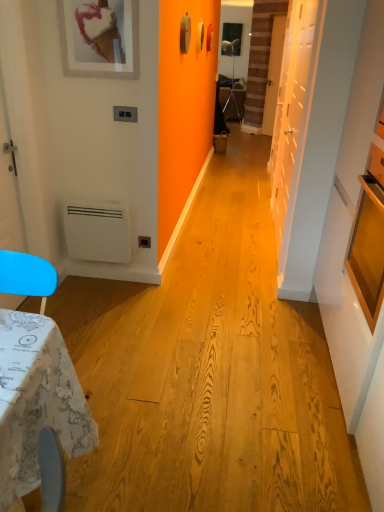
What do you see at coordinates (293, 114) in the screenshot? I see `white matte door at right, placed as the 1th door when sorted from front to back` at bounding box center [293, 114].

Describe the element at coordinates (100, 37) in the screenshot. The width and height of the screenshot is (384, 512). I see `white matte picture frame at upper left` at that location.

Describe the element at coordinates (232, 98) in the screenshot. I see `matte black tripod at center` at that location.

This screenshot has width=384, height=512. Describe the element at coordinates (97, 232) in the screenshot. I see `white matte heater at lower left` at that location.

In order to face wooden door at center, which ranks as the 1th door in back-to-front order, should I rotate leftwards or rightwards?

You should rotate right by 10.668 degrees.

You are a GUI agent. You are given a task and a screenshot of the screen. Output one action in this format:
    pyautogui.click(x=<x>, y=<y>)
    Task: Click on the white matte door at right, which is counted as the second door, starting from the back
    Image resolution: width=384 pixels, height=512 pixels.
    Given the screenshot: What is the action you would take?
    pyautogui.click(x=293, y=114)

From the image's perspective, which one is positioned lower, white matte door at right, placed as the 2th door when sorted from right to left, or white matte heater at lower left?

white matte heater at lower left, from the image's perspective.

Between white matte door at right, which is counted as the second door, starting from the back, and white matte heater at lower left, which one is positioned behind?

white matte heater at lower left is further from the camera.

Between point (299, 125) and point (92, 254), which one is positioned in front?

The point (92, 254) is in front.

Is white matte door at right, which ranks as the second door in top-to-bottom order, thinner than white matte heater at lower left?

Yes, white matte door at right, which ranks as the second door in top-to-bottom order, is thinner than white matte heater at lower left.

Considering the sizes of objects white matte heater at lower left and white matte picture frame at upper left in the image provided, who is taller, white matte heater at lower left or white matte picture frame at upper left?

white matte heater at lower left is taller.

Consider the image. From the image's perspective, is white matte heater at lower left over white matte picture frame at upper left?

Incorrect, from the image's perspective, white matte heater at lower left is lower than white matte picture frame at upper left.

Can you confirm if white matte heater at lower left is positioned to the left of white matte picture frame at upper left?

Yes.

Could you tell me if white matte heater at lower left is facing white matte picture frame at upper left?

No, white matte heater at lower left is not facing towards white matte picture frame at upper left.

From the image's perspective, relative to white matte picture frame at upper left, is wooden door at center, the 2th door positioned from the bottom, above or below?

Clearly, from the image's perspective, wooden door at center, the 2th door positioned from the bottom, is above white matte picture frame at upper left.

How much distance is there between wooden door at center, which appears as the first door when viewed from the top, and white matte picture frame at upper left?

wooden door at center, which appears as the first door when viewed from the top, is 15.36 feet away from white matte picture frame at upper left.

Based on the photo, does wooden door at center, the 2th door when ordered from front to back, have a greater width compared to white matte picture frame at upper left?

Yes.

There is a white matte picture frame at upper left. Where is `the 1st door below it (from a real-world perspective)`? the 1st door below it (from a real-world perspective) is located at coordinates (273, 74).

Is white matte heater at lower left not within white matte door at right, placed as the 2th door when sorted from right to left?

white matte heater at lower left is positioned outside white matte door at right, placed as the 2th door when sorted from right to left.

How many degrees apart are the facing directions of white matte heater at lower left and white matte door at right, placed as the 1th door when sorted from front to back?

white matte heater at lower left and white matte door at right, placed as the 1th door when sorted from front to back, are facing 90.7 degrees away from each other.

Could you tell me if white matte heater at lower left is facing white matte door at right, positioned as the 1th door in left-to-right order?

No, white matte heater at lower left is not oriented towards white matte door at right, positioned as the 1th door in left-to-right order.

Considering the sizes of objects white matte heater at lower left and white matte door at right, which is counted as the second door, starting from the back, in the image provided, who is bigger, white matte heater at lower left or white matte door at right, which is counted as the second door, starting from the back,?

white matte door at right, which is counted as the second door, starting from the back.

From a real-world perspective, which object stands above the other?

wooden door at center, which is the 1th door in right-to-left order, from a real-world perspective.

Is wooden door at center, the second door in the left-to-right sequence, far from matte black tripod at center?

Yes, wooden door at center, the second door in the left-to-right sequence, is far from matte black tripod at center.

Is wooden door at center, which ranks as the 1th door in back-to-front order, further to the viewer compared to matte black tripod at center?

No, wooden door at center, which ranks as the 1th door in back-to-front order, is closer to the viewer.

Which of these two, wooden door at center, which is the 1th door in right-to-left order, or matte black tripod at center, is smaller?

matte black tripod at center is smaller.

Which is closer to the camera, (x=81, y=1) or (x=88, y=225)?

The point (x=81, y=1) is in front.

Would you say white matte picture frame at upper left is inside or outside white matte heater at lower left?

white matte picture frame at upper left is not enclosed by white matte heater at lower left.

Between white matte picture frame at upper left and white matte heater at lower left, which one has larger width?

white matte heater at lower left.

Which point is more forward, (75, 214) or (233, 114)?

Point (75, 214)

Is white matte heater at lower left thinner than matte black tripod at center?

Correct, the width of white matte heater at lower left is less than that of matte black tripod at center.

Can you confirm if white matte heater at lower left is taller than matte black tripod at center?

Incorrect, the height of white matte heater at lower left is not larger of that of matte black tripod at center.

Based on the photo, from the image's perspective, which is above, white matte heater at lower left or matte black tripod at center?

matte black tripod at center is shown above in the image.

Locate an element on the screen. This screenshot has height=512, width=384. door that is the 1st object located above the white matte heater at lower left (from the image's perspective) is located at coordinates (293, 114).

This screenshot has height=512, width=384. What are the coordinates of `appliance on the left of the white matte picture frame at upper left` in the screenshot? It's located at (97, 232).

Based on their spatial positions, is white matte picture frame at upper left or matte black tripod at center closer to white matte door at right, which is counted as the second door, starting from the back?

white matte picture frame at upper left is closer to white matte door at right, which is counted as the second door, starting from the back.

When comparing their distances from white matte picture frame at upper left, does matte black tripod at center or white matte heater at lower left seem closer?

white matte heater at lower left is closer to white matte picture frame at upper left.

From the image, which object appears to be nearer to white matte heater at lower left, white matte picture frame at upper left or matte black tripod at center?

white matte picture frame at upper left.

When comparing their distances from wooden door at center, the 2th door when ordered from front to back, does matte black tripod at center or white matte picture frame at upper left seem further?

The object further to wooden door at center, the 2th door when ordered from front to back, is white matte picture frame at upper left.

Considering their positions, is white matte door at right, which ranks as the second door in top-to-bottom order, positioned closer to matte black tripod at center than wooden door at center, which is the 1th door in right-to-left order?

wooden door at center, which is the 1th door in right-to-left order, is positioned closer to the anchor matte black tripod at center.

Looking at the image, which one is located further to wooden door at center, which ranks as the 1th door in back-to-front order, white matte picture frame at upper left or white matte door at right, placed as the 1th door when sorted from front to back?

white matte picture frame at upper left is further to wooden door at center, which ranks as the 1th door in back-to-front order.

When comparing their distances from white matte heater at lower left, does matte black tripod at center or white matte picture frame at upper left seem further?

Among the two, matte black tripod at center is located further to white matte heater at lower left.

From the image, which object appears to be farther from white matte picture frame at upper left, white matte door at right, which is counted as the second door, starting from the back, or wooden door at center, which is the 1th door in right-to-left order?

wooden door at center, which is the 1th door in right-to-left order, is further to white matte picture frame at upper left.

Image resolution: width=384 pixels, height=512 pixels. I want to click on door located between white matte heater at lower left and matte black tripod at center in the depth direction, so click(273, 74).

This screenshot has width=384, height=512. Find the location of `appliance positioned between white matte picture frame at upper left and matte black tripod at center from near to far`. appliance positioned between white matte picture frame at upper left and matte black tripod at center from near to far is located at coordinates (97, 232).

The height and width of the screenshot is (512, 384). In order to click on door between white matte door at right, positioned as the 1th door in bottom-to-top order, and matte black tripod at center, along the z-axis in this screenshot , I will do `click(273, 74)`.

What are the coordinates of `appliance between white matte door at right, positioned as the 1th door in bottom-to-top order, and wooden door at center, the 2th door positioned from the bottom, in the front-back direction` in the screenshot? It's located at (97, 232).